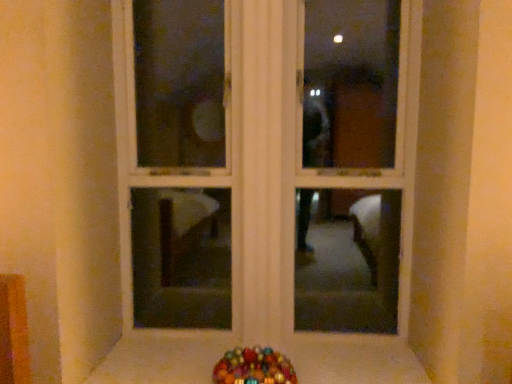
In order to click on vacant region above smooth white surface at lower center (from a real-world perspective) in this screenshot , I will do `click(234, 350)`.